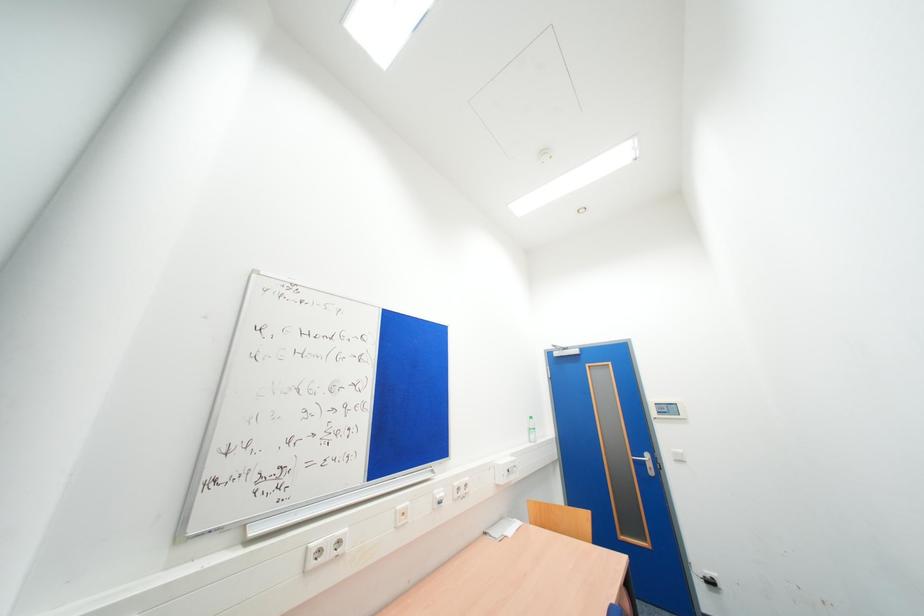
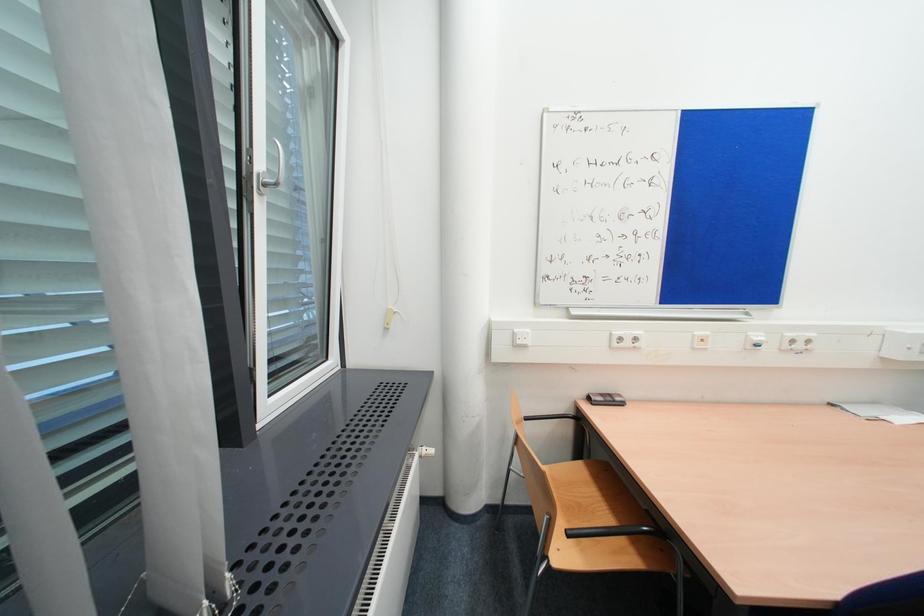
Based on the continuous images, in which direction is the camera rotating?

The camera rotated toward left-down.